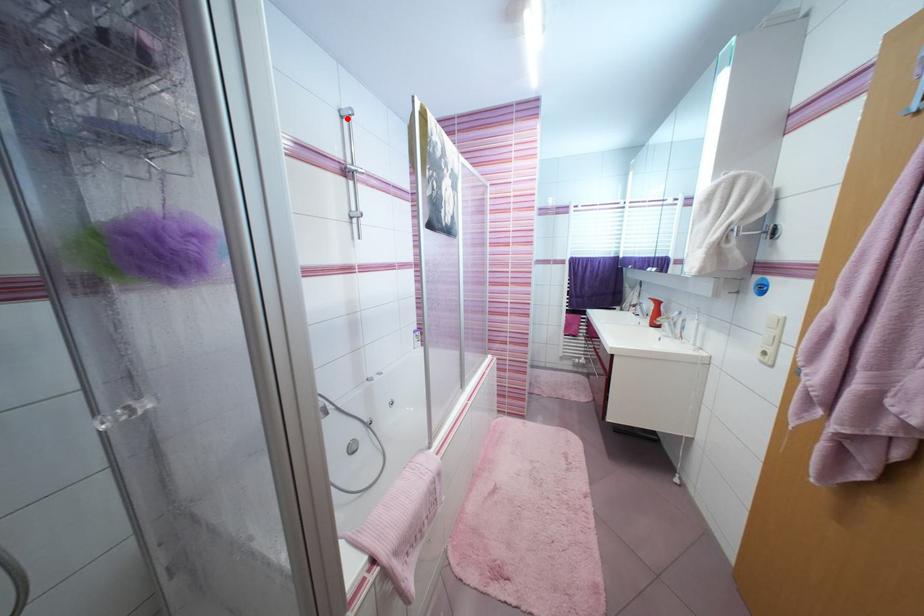
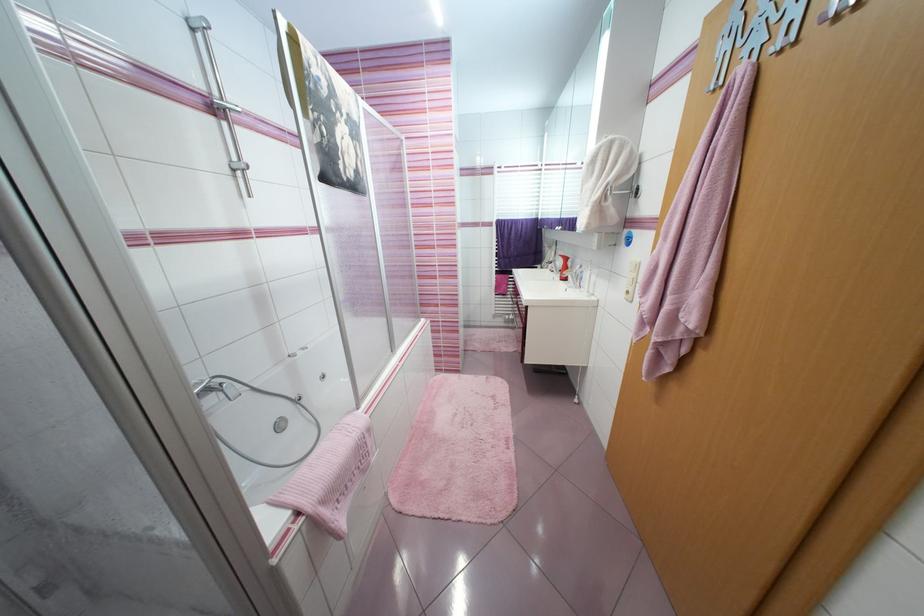
Locate, in the second image, the point that corresponds to the highlighted location in the first image.

(198, 31)